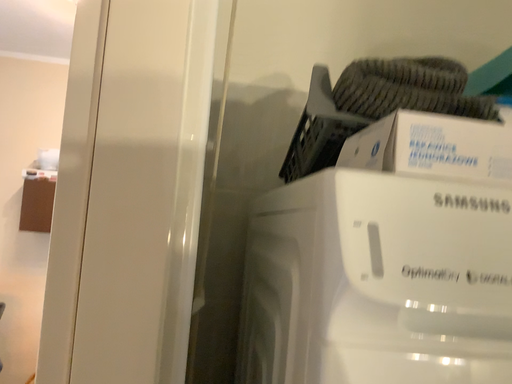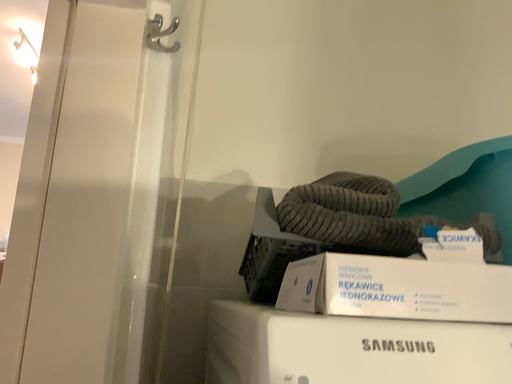
Question: How did the camera likely rotate when shooting the video?

Choices:
 (A) rotated upward
 (B) rotated downward

Answer: (A)